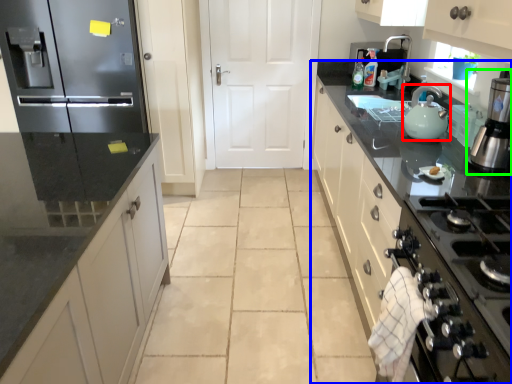
Question: Estimate the real-world distances between objects in this image. Which object is farther from kitchen appliance (highlighted by a red box), countertop (highlighted by a blue box) or home appliance (highlighted by a green box)?

Choices:
 (A) countertop
 (B) home appliance

Answer: (A)